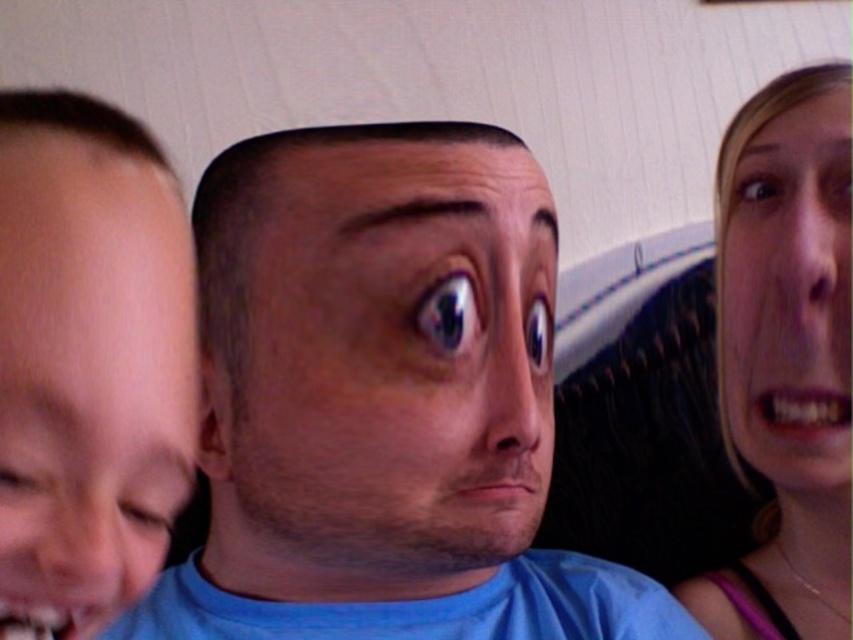
Which is behind, point (318, 150) or point (793, 468)?

Point (793, 468)

Identify the location of blue matte face at center. (380, 400).

At what (x,y) coordinates should I click in order to perform the action: click on blue matte face at center. Please return your answer as a coordinate pair (x, y). Looking at the image, I should click on (380, 400).

Is blonde hair at right further to the viewer compared to white glossy teeth at lower left?

Yes, blonde hair at right is further from the viewer.

Does point (723, 404) come closer to viewer compared to point (39, 616)?

No, it is behind (39, 616).

Where is `blonde hair at right`? The height and width of the screenshot is (640, 853). blonde hair at right is located at coordinates (787, 296).

Is brown matte face at center closer to the viewer compared to white glossy teeth at lower left?

No, brown matte face at center is behind white glossy teeth at lower left.

Between brown matte face at center and white glossy teeth at lower left, which one is positioned higher?

brown matte face at center

Is point (451, 259) more distant than point (62, 620)?

That is True.

Where is `brown matte face at center`? brown matte face at center is located at coordinates (392, 355).